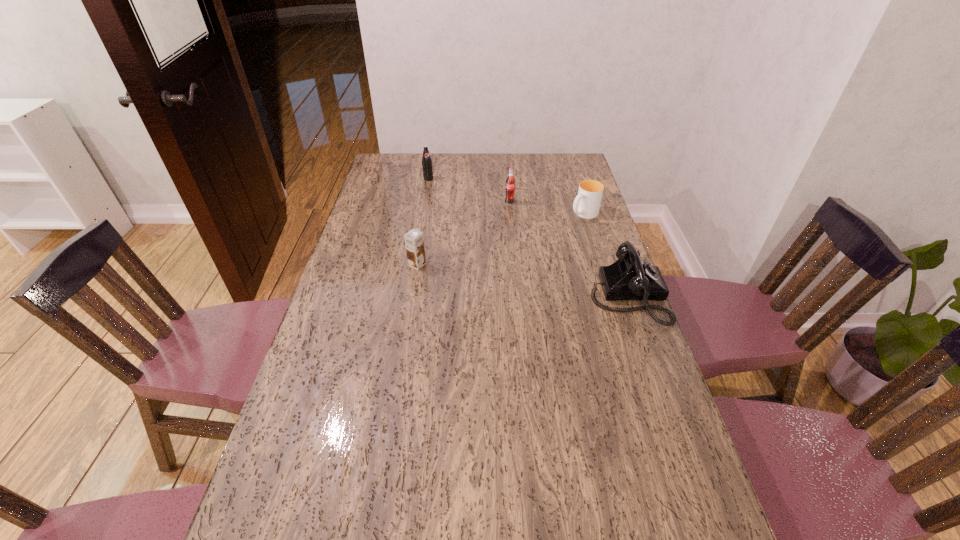
Locate an element on the screen. The width and height of the screenshot is (960, 540). vacant area between the telephone and the third object from left to right is located at coordinates (568, 249).

Where is `free space between the left pop and the chocolate milk`? This screenshot has height=540, width=960. free space between the left pop and the chocolate milk is located at coordinates (422, 222).

Locate an element on the screen. free spot between the farther pop and the chocolate milk is located at coordinates (422, 222).

At what (x,y) coordinates should I click in order to perform the action: click on unoccupied position between the telephone and the farther pop. Please return your answer as a coordinate pair (x, y). The image size is (960, 540). Looking at the image, I should click on (528, 237).

Image resolution: width=960 pixels, height=540 pixels. I want to click on free spot between the farthest object and the chocolate milk, so click(422, 222).

This screenshot has width=960, height=540. Find the location of `vacant space that's between the farthest object and the chocolate milk`. vacant space that's between the farthest object and the chocolate milk is located at coordinates (422, 222).

This screenshot has width=960, height=540. What are the coordinates of `object that is the nearest to the chocolate milk` in the screenshot? It's located at (510, 182).

Locate which object ranks second in proximity to the chocolate milk. Please provide its 2D coordinates. Your answer should be formatted as a tuple, i.e. [(x, y)], where the tuple contains the x and y coordinates of a point satisfying the conditions above.

[(427, 167)]

You are a GUI agent. You are given a task and a screenshot of the screen. Output one action in this format:
    pyautogui.click(x=<x>, y=<y>)
    Task: Click on the vacant space that satisfies the following two spatial constraints: 1. on the back side of the right pop; 2. on the right side of the chocolate milk
    
    Given the screenshot: What is the action you would take?
    pyautogui.click(x=427, y=202)

I want to click on free space that satisfies the following two spatial constraints: 1. on the back side of the cup; 2. on the right side of the chocolate milk, so click(425, 214).